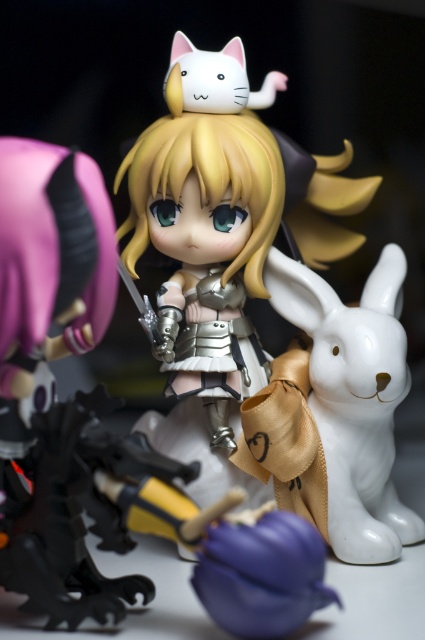
You are a photographer setting up a shoot for the figurines. You need to place a spotlight directly above the satin gold armor at center. According to the coordinates provided, where should you position the spotlight?

The satin gold armor at center is located at point (223, 220), so you should position the spotlight directly above these coordinates to ensure it illuminates the armor properly.

What object is located at the coordinates point (223,220) in the image?

The point (223,220) marks the satin gold armor at center.